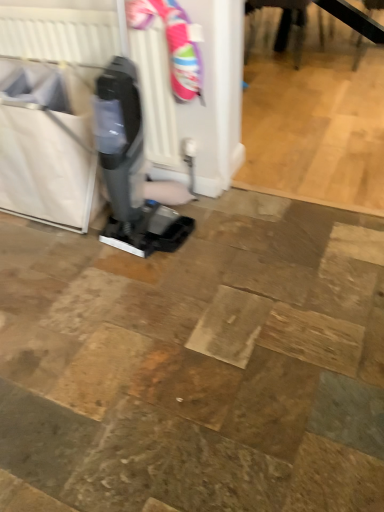
The height and width of the screenshot is (512, 384). What do you see at coordinates (59, 35) in the screenshot?
I see `white plastic radiator at upper left` at bounding box center [59, 35].

Measure the distance between white plastic radiator at upper left and camera.

A distance of 1.48 meters exists between white plastic radiator at upper left and camera.

Where is `white plastic radiator at upper left`? Image resolution: width=384 pixels, height=512 pixels. white plastic radiator at upper left is located at coordinates (59, 35).

What is the approximate width of white fabric laundry basket at left?

The width of white fabric laundry basket at left is 16.97 inches.

You are a GUI agent. You are given a task and a screenshot of the screen. Output one action in this format:
    pyautogui.click(x=<x>, y=<y>)
    Task: Click on the white fabric laundry basket at left
    The height and width of the screenshot is (512, 384).
    Given the screenshot: What is the action you would take?
    pyautogui.click(x=47, y=145)

This screenshot has height=512, width=384. Describe the element at coordinates (47, 145) in the screenshot. I see `white fabric laundry basket at left` at that location.

Where is `white plastic radiator at upper left`? The height and width of the screenshot is (512, 384). white plastic radiator at upper left is located at coordinates (59, 35).

Consider the image. Considering the relative positions of white plastic radiator at upper left and white fabric laundry basket at left in the image provided, is white plastic radiator at upper left to the left of white fabric laundry basket at left from the viewer's perspective?

No.

Does white plastic radiator at upper left lie in front of white fabric laundry basket at left?

That is False.

Considering the positions of point (14, 47) and point (6, 140), is point (14, 47) closer or farther from the camera than point (6, 140)?

Clearly, point (14, 47) is more distant from the camera than point (6, 140).

From the image's perspective, is white plastic radiator at upper left above or below white fabric laundry basket at left?

white plastic radiator at upper left is situated higher than white fabric laundry basket at left in the image.

From a real-world perspective, is white plastic radiator at upper left located beneath white fabric laundry basket at left?

No, from a real-world perspective, white plastic radiator at upper left is not beneath white fabric laundry basket at left.

Looking at their sizes, would you say white plastic radiator at upper left is wider or thinner than white fabric laundry basket at left?

In the image, white plastic radiator at upper left appears to be more narrow than white fabric laundry basket at left.

Which of these two, white plastic radiator at upper left or white fabric laundry basket at left, stands shorter?

white fabric laundry basket at left is shorter.

Based on the photo, can you confirm if white plastic radiator at upper left is smaller than white fabric laundry basket at left?

Correct, white plastic radiator at upper left occupies less space than white fabric laundry basket at left.

Is white plastic radiator at upper left completely or partially outside of white fabric laundry basket at left?

Answer: Actually, white plastic radiator at upper left is within white fabric laundry basket at left.

Is white plastic radiator at upper left far from white fabric laundry basket at left?

No, white plastic radiator at upper left is in close proximity to white fabric laundry basket at left.

Is white plastic radiator at upper left aimed at white fabric laundry basket at left?

Yes, white plastic radiator at upper left is oriented towards white fabric laundry basket at left.

Consider the image. Measure the distance between white plastic radiator at upper left and white fabric laundry basket at left.

white plastic radiator at upper left is 11.78 inches from white fabric laundry basket at left.

This screenshot has width=384, height=512. What are the coordinates of `radiator that is behind the white fabric laundry basket at left` in the screenshot? It's located at (59, 35).

Between white fabric laundry basket at left and white plastic radiator at upper left, which one appears on the left side from the viewer's perspective?

From the viewer's perspective, white fabric laundry basket at left appears more on the left side.

Is the position of white fabric laundry basket at left more distant than that of white plastic radiator at upper left?

No, white fabric laundry basket at left is closer to the camera.

Which is behind, point (40, 113) or point (22, 13)?

The point (22, 13) is behind.

From the image's perspective, which one is positioned lower, white fabric laundry basket at left or white plastic radiator at upper left?

white fabric laundry basket at left appears lower in the image.

From a real-world perspective, is white fabric laundry basket at left positioned above or below white plastic radiator at upper left?

white fabric laundry basket at left is situated lower than white plastic radiator at upper left in the real world.

In the scene shown: Can you confirm if white fabric laundry basket at left is thinner than white plastic radiator at upper left?

Incorrect, the width of white fabric laundry basket at left is not less than that of white plastic radiator at upper left.

Considering the sizes of objects white fabric laundry basket at left and white plastic radiator at upper left in the image provided, who is taller, white fabric laundry basket at left or white plastic radiator at upper left?

With more height is white plastic radiator at upper left.

Considering the relative sizes of white fabric laundry basket at left and white plastic radiator at upper left in the image provided, is white fabric laundry basket at left smaller than white plastic radiator at upper left?

Incorrect, white fabric laundry basket at left is not smaller in size than white plastic radiator at upper left.

Is white plastic radiator at upper left surrounded by white fabric laundry basket at left?

Yes, white plastic radiator at upper left is a part of white fabric laundry basket at left.

Would you say white fabric laundry basket at left is a long distance from white plastic radiator at upper left?

Actually, white fabric laundry basket at left and white plastic radiator at upper left are a little close together.

Is white fabric laundry basket at left turned away from white plastic radiator at upper left?

Yes.

How different are the orientations of white fabric laundry basket at left and white plastic radiator at upper left in degrees?

The angular difference between white fabric laundry basket at left and white plastic radiator at upper left is 0.000898 degrees.

Identify the location of laundry basket below the white plastic radiator at upper left (from the image's perspective). (47, 145).

Locate an element on the screen. radiator that appears on the right of white fabric laundry basket at left is located at coordinates (59, 35).

The image size is (384, 512). Find the location of `laundry basket to the left of white plastic radiator at upper left`. laundry basket to the left of white plastic radiator at upper left is located at coordinates (47, 145).